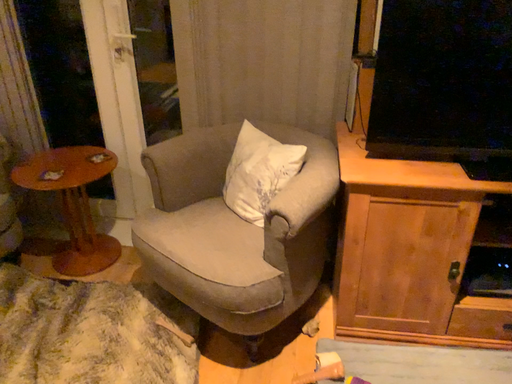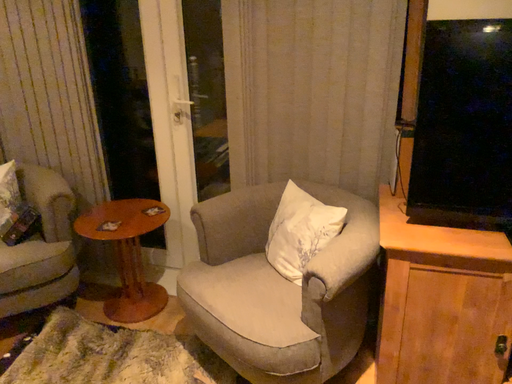
Question: Which way did the camera rotate in the video?

Choices:
 (A) rotated downward
 (B) rotated upward

Answer: (B)